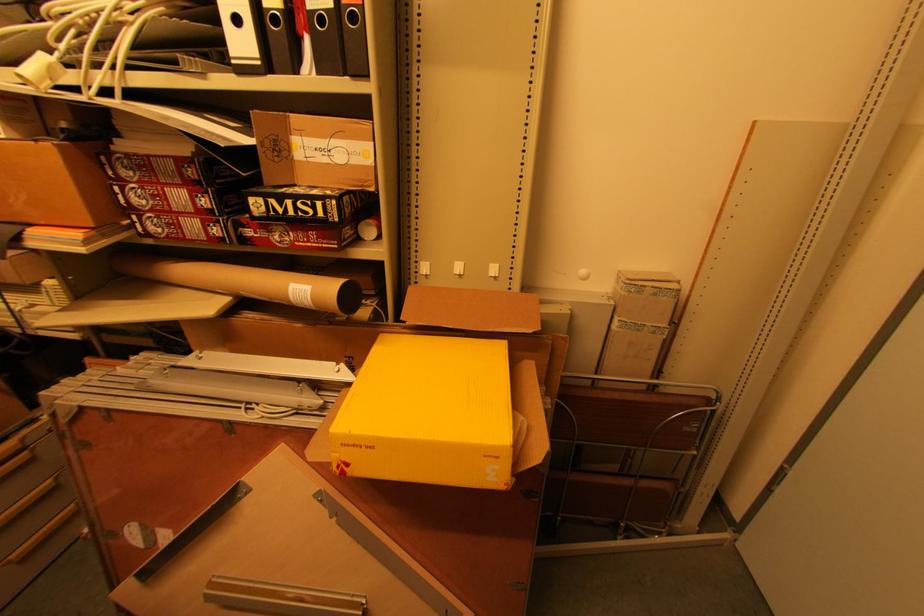
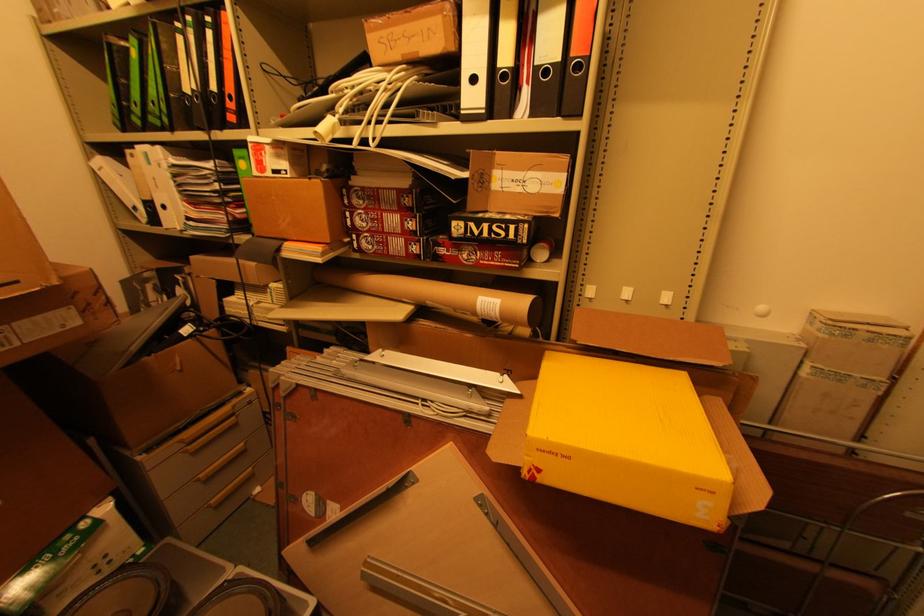
Question: The camera is either moving clockwise (left) or counter-clockwise (right) around the object. The first image is from the beginning of the video and the second image is from the end. Is the camera moving left or right when shooting the video?

Choices:
 (A) Left
 (B) Right

Answer: (B)